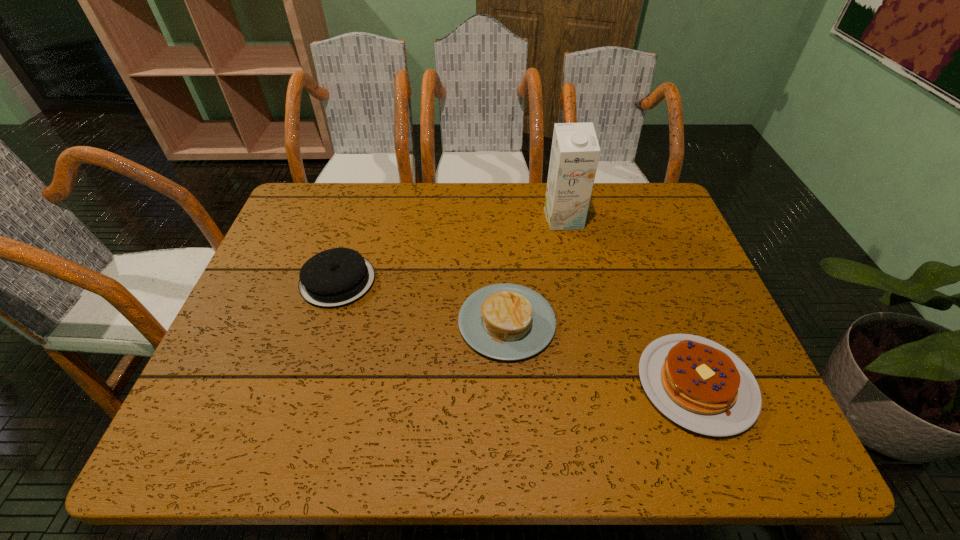
Find the location of `carton`. carton is located at coordinates (575, 151).

Image resolution: width=960 pixels, height=540 pixels. I want to click on the second object from right to left, so click(x=575, y=151).

You are a GUI agent. You are given a task and a screenshot of the screen. Output one action in this format:
    pyautogui.click(x=<x>, y=<y>)
    Task: Click on the second pancake from left to right
    
    Given the screenshot: What is the action you would take?
    pyautogui.click(x=504, y=321)

This screenshot has height=540, width=960. I want to click on the leftmost pancake, so click(336, 277).

Where is `the rightmost object`? This screenshot has height=540, width=960. the rightmost object is located at coordinates (699, 384).

The width and height of the screenshot is (960, 540). I want to click on vacant space located 0.160m on the front of the second object from right to left, so click(x=574, y=271).

In order to click on vacant region located on the back of the third object from right to left in this screenshot , I will do `click(501, 212)`.

Image resolution: width=960 pixels, height=540 pixels. I want to click on vacant space situated on the back of the leftmost pancake, so click(x=359, y=211).

Identify the location of free point located on the left of the rightmost pancake. The image size is (960, 540). (449, 384).

Identify the location of object present at the far edge. The image size is (960, 540). (x=575, y=151).